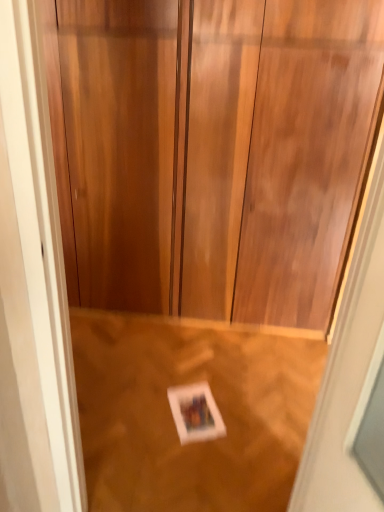
Question: Is wooden floor at lower center to the right of wooden door at center from the viewer's perspective?

Choices:
 (A) no
 (B) yes

Answer: (A)

Question: From a real-world perspective, does wooden floor at lower center sit lower than wooden door at center?

Choices:
 (A) yes
 (B) no

Answer: (A)

Question: From a real-world perspective, is wooden floor at lower center positioned over wooden door at center based on gravity?

Choices:
 (A) yes
 (B) no

Answer: (B)

Question: Does wooden floor at lower center have a larger size compared to wooden door at center?

Choices:
 (A) no
 (B) yes

Answer: (A)

Question: From the image's perspective, is wooden floor at lower center beneath wooden door at center?

Choices:
 (A) yes
 (B) no

Answer: (A)

Question: Which is correct: wooden door at center is inside white paper at center, or outside of it?

Choices:
 (A) outside
 (B) inside

Answer: (A)

Question: From the image's perspective, is wooden door at center positioned above or below white paper at center?

Choices:
 (A) above
 (B) below

Answer: (A)

Question: From a real-world perspective, is wooden door at center above or below white paper at center?

Choices:
 (A) above
 (B) below

Answer: (A)

Question: Is wooden door at center taller or shorter than white paper at center?

Choices:
 (A) short
 (B) tall

Answer: (B)

Question: From the image's perspective, is wooden floor at lower center positioned above or below white paper at center?

Choices:
 (A) below
 (B) above

Answer: (B)

Question: In terms of height, does wooden floor at lower center look taller or shorter compared to white paper at center?

Choices:
 (A) tall
 (B) short

Answer: (A)

Question: Is wooden floor at lower center inside or outside of white paper at center?

Choices:
 (A) inside
 (B) outside

Answer: (B)

Question: Relative to white paper at center, is wooden floor at lower center in front or behind?

Choices:
 (A) behind
 (B) front

Answer: (B)

Question: Is wooden door at center spatially inside wooden floor at lower center, or outside of it?

Choices:
 (A) inside
 (B) outside

Answer: (B)

Question: From a real-world perspective, relative to wooden floor at lower center, is wooden door at center vertically above or below?

Choices:
 (A) above
 (B) below

Answer: (A)